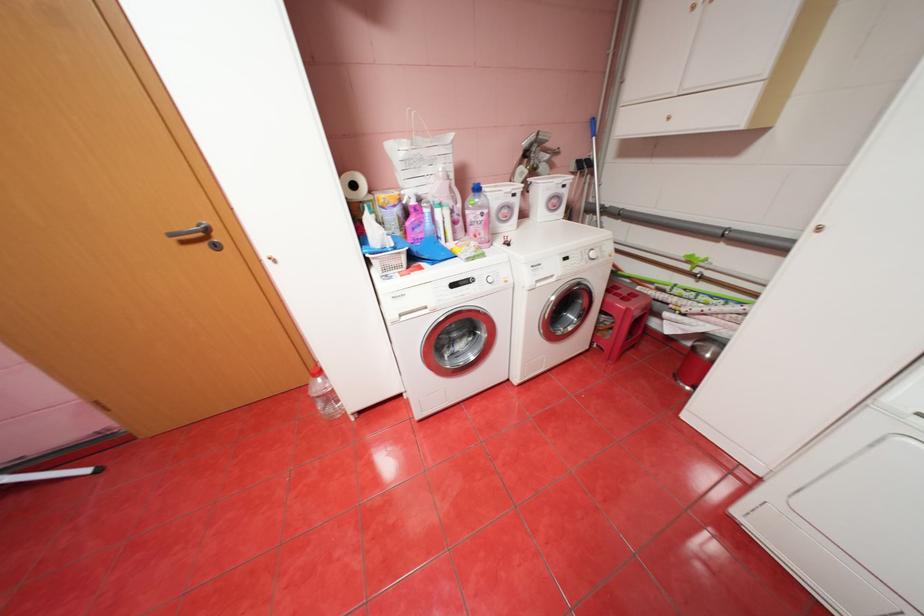
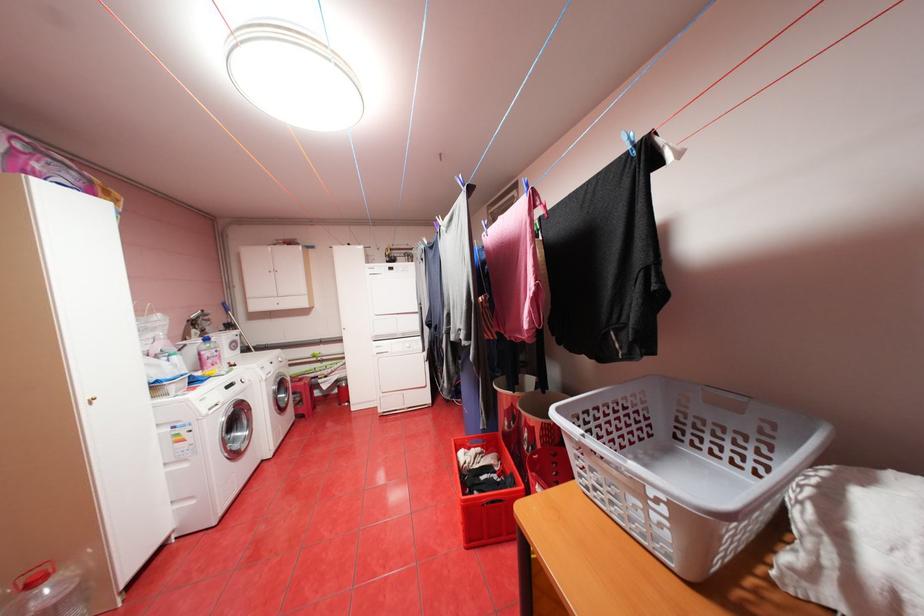
Locate, in the second image, the point that corresponds to point 476,281 in the first image.

(241, 384)